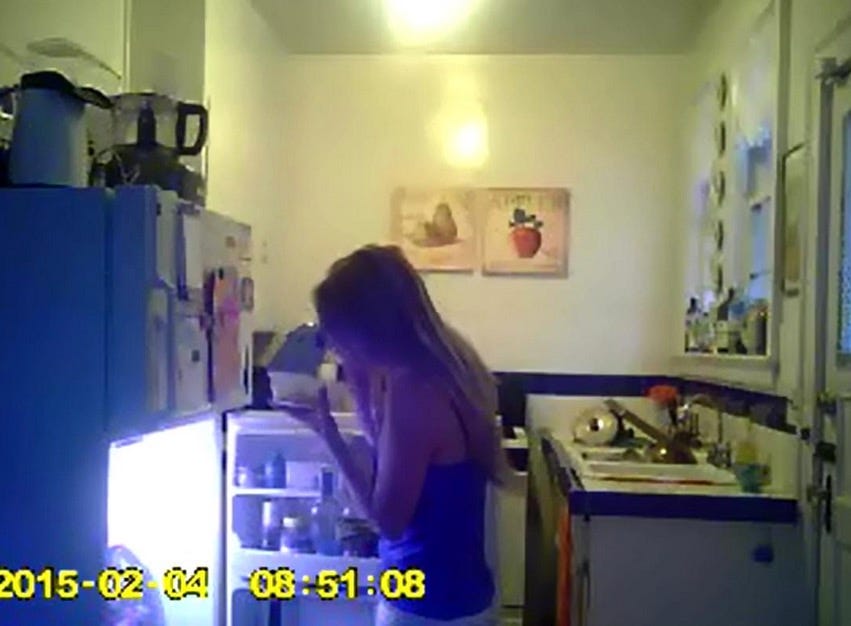
Where is `wall`? This screenshot has height=626, width=851. wall is located at coordinates (609, 223).